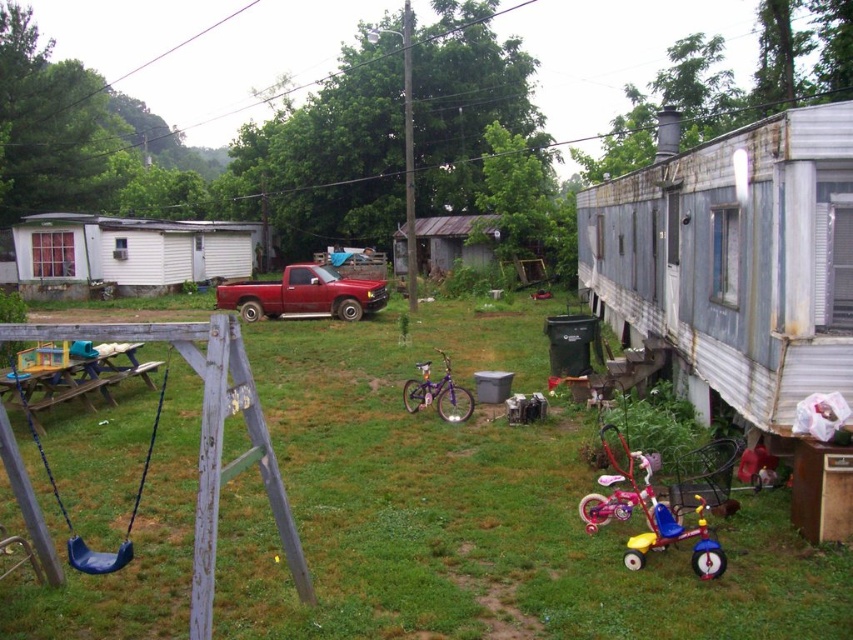
Is blue plastic swing at lower left closer to camera compared to purple metallic bicycle at center?

Yes, it is.

Between point (16, 380) and point (456, 417), which one is positioned behind?

The point (456, 417) is more distant.

Between point (28, 422) and point (445, 372), which one is positioned behind?

Point (445, 372)

The height and width of the screenshot is (640, 853). Identify the location of blue plastic swing at lower left. (65, 509).

Which is above, metallic red truck at center or purple metallic bicycle at center?

Positioned higher is metallic red truck at center.

Consider the image. Who is positioned more to the right, metallic red truck at center or purple metallic bicycle at center?

purple metallic bicycle at center is more to the right.

This screenshot has width=853, height=640. Describe the element at coordinates (303, 294) in the screenshot. I see `metallic red truck at center` at that location.

Locate an element on the screen. metallic red truck at center is located at coordinates (303, 294).

Does green grass at center appear over metallic red truck at center?

Incorrect, green grass at center is not positioned above metallic red truck at center.

In the scene shown: Which of these two, green grass at center or metallic red truck at center, stands taller?

With more height is metallic red truck at center.

You are a GUI agent. You are given a task and a screenshot of the screen. Output one action in this format:
    pyautogui.click(x=<x>, y=<y>)
    Task: Click on the green grass at center
    This screenshot has width=853, height=640.
    Given the screenshot: What is the action you would take?
    pyautogui.click(x=474, y=509)